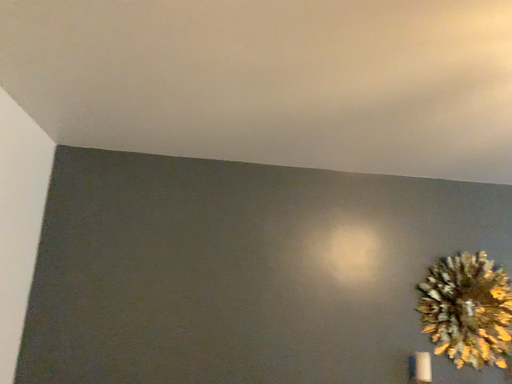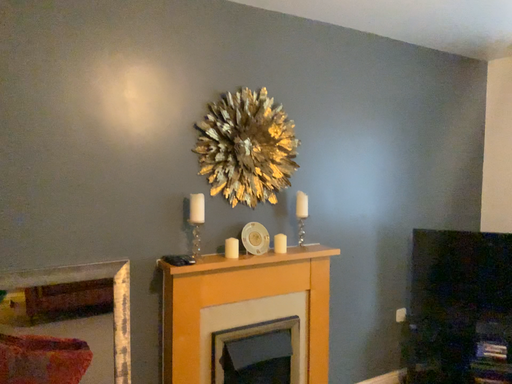
Question: How did the camera likely rotate when shooting the video?

Choices:
 (A) rotated downward
 (B) rotated upward

Answer: (A)